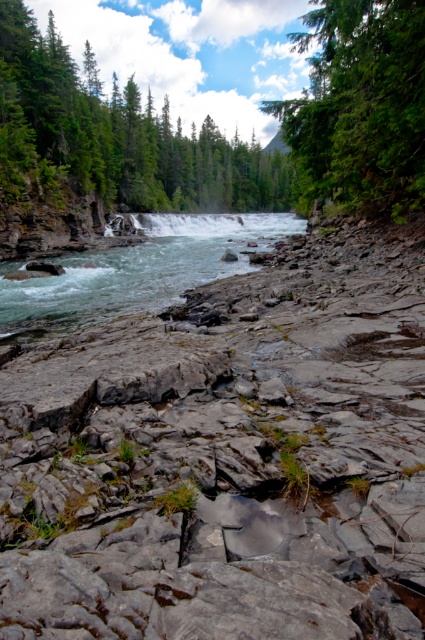
Question: Does gray rock at center lie in front of white frothy water at center?

Choices:
 (A) no
 (B) yes

Answer: (B)

Question: Which of the following is the farthest from the observer?

Choices:
 (A) white frothy water at center
 (B) gray rock at center
 (C) green matte tree at upper right
 (D) green matte tree at upper center

Answer: (A)

Question: Is green matte tree at upper center to the left of white frothy water at center from the viewer's perspective?

Choices:
 (A) yes
 (B) no

Answer: (A)

Question: Which object is positioned farthest from the green matte tree at upper center?

Choices:
 (A) gray rock at center
 (B) green matte tree at upper right

Answer: (A)

Question: Is green matte tree at upper right bigger than white frothy water at center?

Choices:
 (A) no
 (B) yes

Answer: (B)

Question: Which object is positioned farthest from the gray rock at center?

Choices:
 (A) green matte tree at upper center
 (B) green matte tree at upper right
 (C) white frothy water at center

Answer: (C)